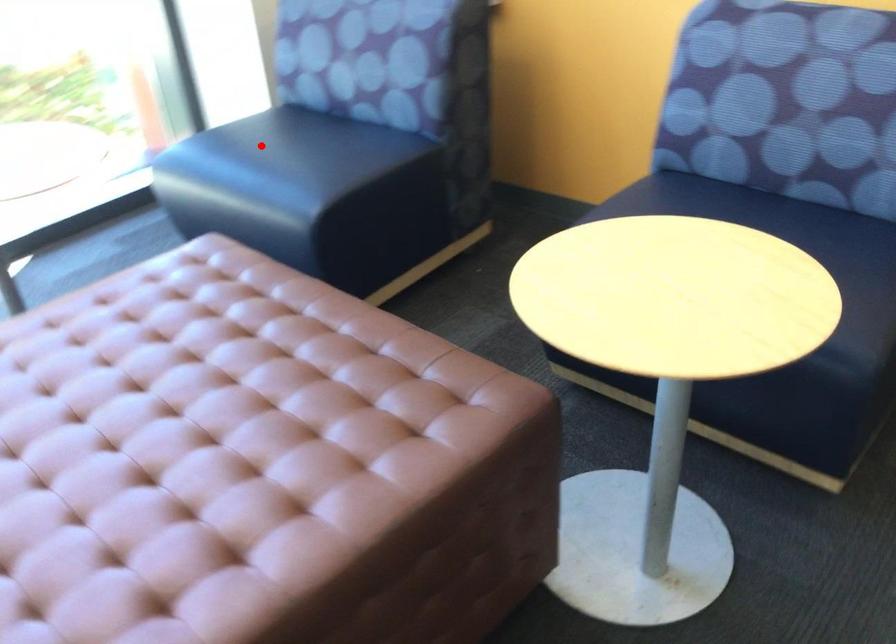
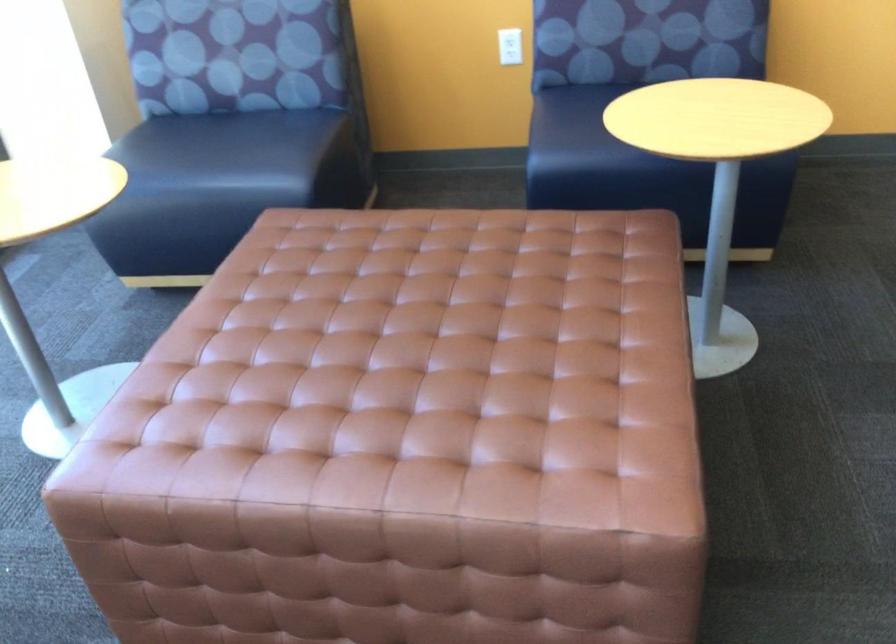
Where in the second image is the point corresponding to the highlighted location from the first image?

(199, 149)